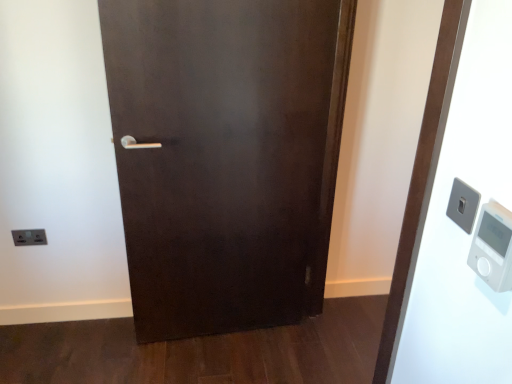
Question: From the image's perspective, is white plastic thermometer at right above satin silver switch at upper right, the second light switch viewed from the back?

Choices:
 (A) yes
 (B) no

Answer: (B)

Question: Does white plastic thermometer at right have a lesser height compared to satin silver switch at upper right, the second light switch viewed from the back?

Choices:
 (A) yes
 (B) no

Answer: (B)

Question: Does white plastic thermometer at right have a smaller size compared to satin silver switch at upper right, the 2th light switch from the left?

Choices:
 (A) no
 (B) yes

Answer: (A)

Question: Considering the relative sizes of white plastic thermometer at right and satin silver switch at upper right, the second light switch viewed from the back, in the image provided, is white plastic thermometer at right bigger than satin silver switch at upper right, the second light switch viewed from the back,?

Choices:
 (A) yes
 (B) no

Answer: (A)

Question: From the image's perspective, would you say white plastic thermometer at right is shown under satin silver switch at upper right, the second light switch viewed from the back?

Choices:
 (A) no
 (B) yes

Answer: (B)

Question: Relative to satin silver switch at lower left, the 2th light switch from the right, is white plastic elevator at right in front or behind?

Choices:
 (A) front
 (B) behind

Answer: (A)

Question: Would you say white plastic elevator at right is to the left or to the right of satin silver switch at lower left, the second light switch when ordered from top to bottom, in the picture?

Choices:
 (A) left
 (B) right

Answer: (B)

Question: In terms of width, does white plastic elevator at right look wider or thinner when compared to satin silver switch at lower left, the 2th light switch from the right?

Choices:
 (A) wide
 (B) thin

Answer: (A)

Question: In terms of height, does white plastic elevator at right look taller or shorter compared to satin silver switch at lower left, the second light switch when ordered from top to bottom?

Choices:
 (A) short
 (B) tall

Answer: (B)

Question: From a real-world perspective, is white plastic thermometer at right above or below white plastic elevator at right?

Choices:
 (A) below
 (B) above

Answer: (B)

Question: Does point (480, 246) appear closer or farther from the camera than point (476, 273)?

Choices:
 (A) closer
 (B) farther

Answer: (A)

Question: Is white plastic thermometer at right wider or thinner than white plastic elevator at right?

Choices:
 (A) thin
 (B) wide

Answer: (A)

Question: Relative to white plastic elevator at right, is white plastic thermometer at right in front or behind?

Choices:
 (A) behind
 (B) front

Answer: (B)

Question: In terms of width, does white plastic elevator at right look wider or thinner when compared to satin silver switch at upper right, the second light switch viewed from the back?

Choices:
 (A) wide
 (B) thin

Answer: (A)

Question: Relative to satin silver switch at upper right, the first light switch from the right, is white plastic elevator at right in front or behind?

Choices:
 (A) front
 (B) behind

Answer: (A)